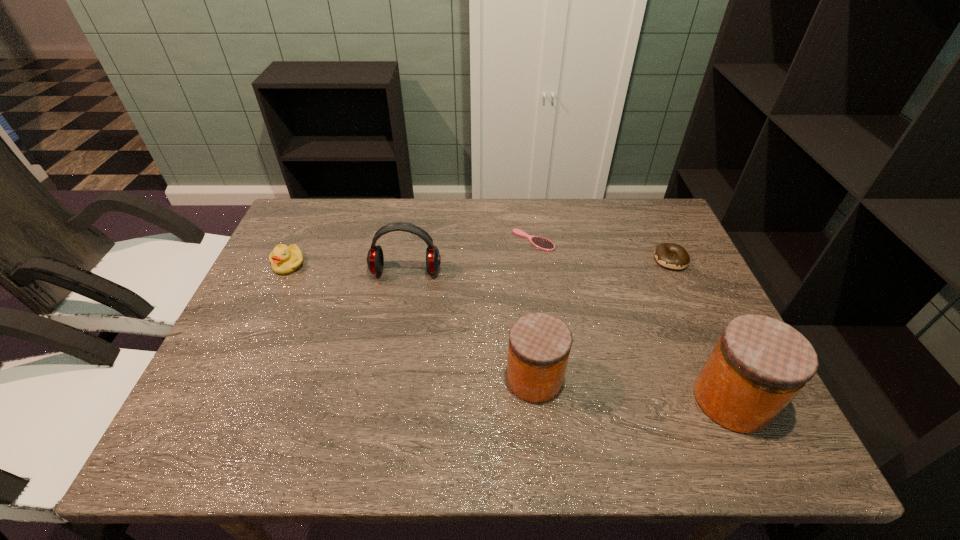
The image size is (960, 540). What are the coordinates of `the left jar` in the screenshot? It's located at (539, 346).

Identify the location of the right jar. This screenshot has width=960, height=540. (759, 364).

In order to click on the tallest object in this screenshot , I will do `click(759, 364)`.

This screenshot has height=540, width=960. What are the coordinates of `earphone` in the screenshot? It's located at (375, 260).

The height and width of the screenshot is (540, 960). Identify the location of hairbrush. (541, 243).

Locate an element on the screen. the leftmost object is located at coordinates (284, 259).

Find the location of a particular element. duckling is located at coordinates pos(284,259).

Locate an element on the screen. the fifth tallest object is located at coordinates (663, 253).

Find the location of a particular element. vacant space located on the back of the left jar is located at coordinates [525, 285].

At what (x,y) coordinates should I click in order to perform the action: click on free space located on the left of the right jar. Please return your answer as a coordinate pair (x, y). Looking at the image, I should click on (634, 400).